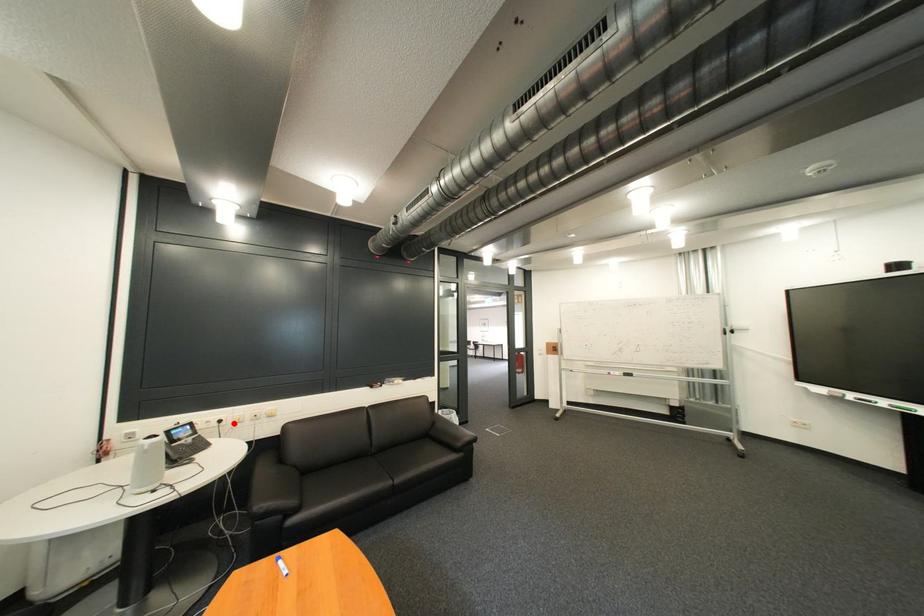
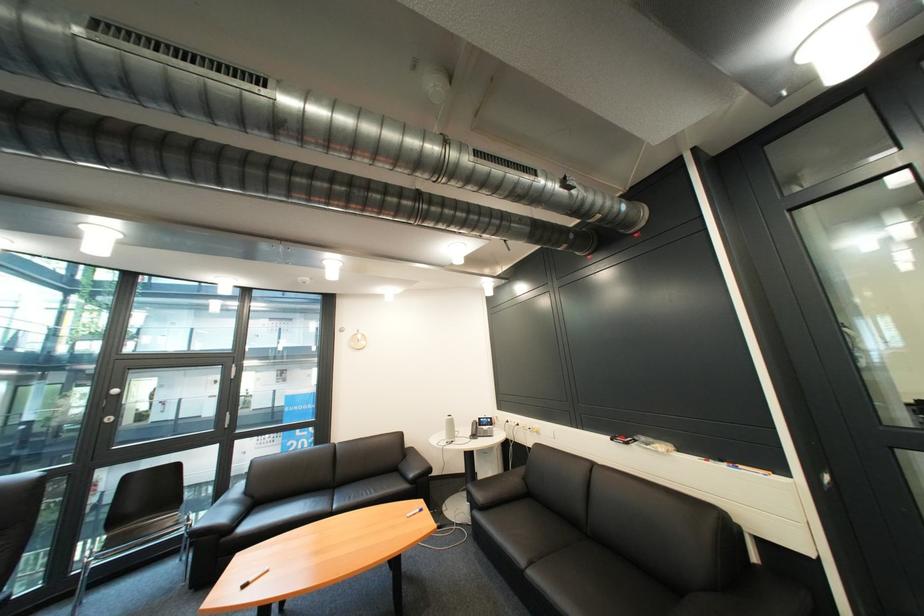
In the second image, find the point that corresponds to the highlighted location in the first image.

(531, 426)